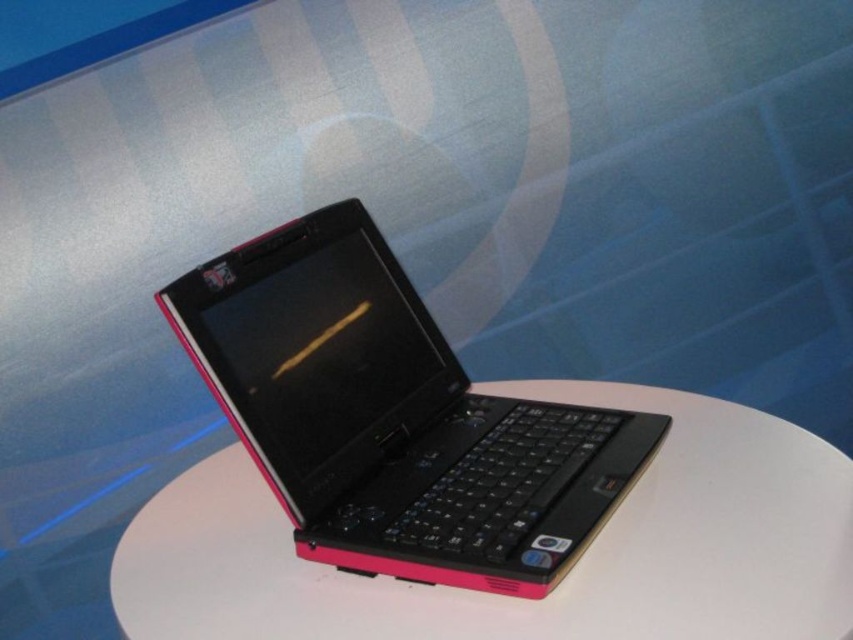
Question: Which point is farther to the camera?

Choices:
 (A) 689,522
 (B) 404,400

Answer: (B)

Question: Does pink plastic laptop at center have a larger size compared to white matte round table at center?

Choices:
 (A) no
 (B) yes

Answer: (A)

Question: Can you confirm if pink plastic laptop at center is positioned to the left of white matte round table at center?

Choices:
 (A) yes
 (B) no

Answer: (A)

Question: Does pink plastic laptop at center have a larger size compared to white matte round table at center?

Choices:
 (A) no
 (B) yes

Answer: (A)